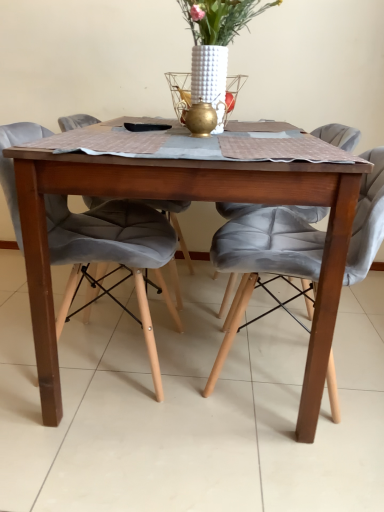
This screenshot has height=512, width=384. What are the coordinates of `vacant space in front of white textured vase at center` in the screenshot? It's located at pyautogui.click(x=238, y=148).